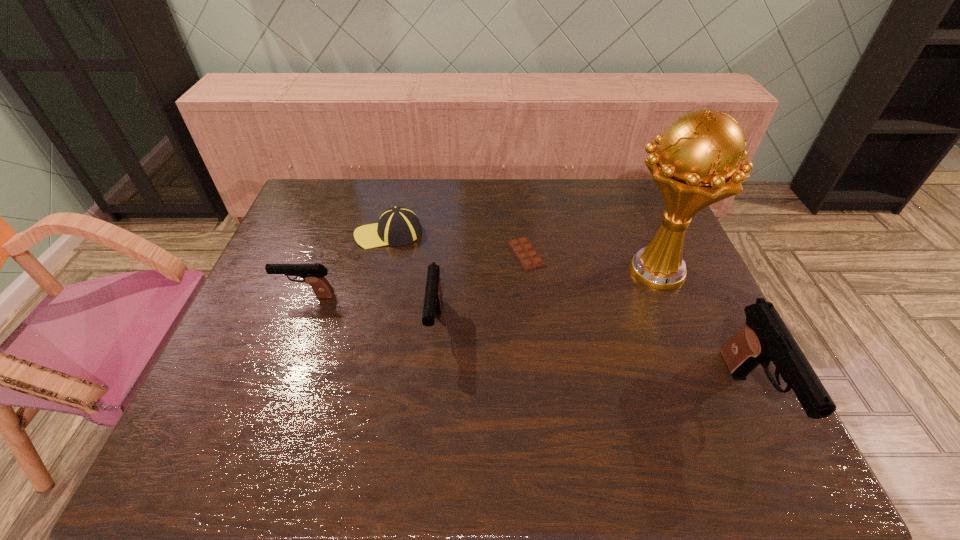
What are the coordinates of `free spot between the chocolate bar and the baseball cap` in the screenshot? It's located at (458, 244).

Where is `unoccupied position between the third object from left to right and the tallest pistol`? The height and width of the screenshot is (540, 960). unoccupied position between the third object from left to right and the tallest pistol is located at coordinates (592, 362).

Select which object is the fourth closest to the shortest pistol. Please provide its 2D coordinates. Your answer should be formatted as a tuple, i.e. [(x, y)], where the tuple contains the x and y coordinates of a point satisfying the conditions above.

[(696, 164)]

At what (x,y) coordinates should I click in order to perform the action: click on object that ranks as the fifth closest to the fifth tallest object. Please return your answer as a coordinate pair (x, y). The height and width of the screenshot is (540, 960). Looking at the image, I should click on (765, 337).

I want to click on pistol that is the second closest to the shortest object, so click(765, 337).

Point out which pistol is positioned as the second nearest to the shortest pistol. Please provide its 2D coordinates. Your answer should be formatted as a tuple, i.e. [(x, y)], where the tuple contains the x and y coordinates of a point satisfying the conditions above.

[(765, 337)]

The width and height of the screenshot is (960, 540). I want to click on free space that satisfies the following two spatial constraints: 1. on the back side of the fourth object from left to right; 2. with the brim of the fifth object from right to left facing forward, so (x=524, y=234).

Find the location of a particular element. vacant space that satisfies the following two spatial constraints: 1. at the front of the trophy_cup where the globe is prominent; 2. at the barrel of the fourth shortest object is located at coordinates (677, 326).

You are a GUI agent. You are given a task and a screenshot of the screen. Output one action in this format:
    pyautogui.click(x=<x>, y=<y>)
    Task: Click on the vacant area that satisfies the following two spatial constraints: 1. on the back side of the fourth object from left to right; 2. with the brim of the second shortest object facing forward
    This screenshot has width=960, height=540.
    Given the screenshot: What is the action you would take?
    pyautogui.click(x=524, y=234)

This screenshot has height=540, width=960. What are the coordinates of `vacant space that satisfies the following two spatial constraints: 1. on the front side of the shortest object; 2. at the barrel of the leftmost object` in the screenshot? It's located at (531, 296).